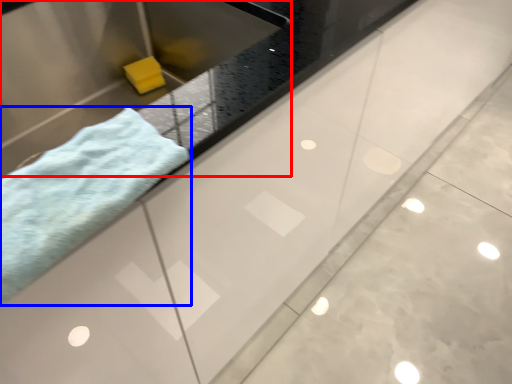
Question: Among these objects, which one is farthest to the camera, sink (highlighted by a red box) or towel (highlighted by a blue box)?

Choices:
 (A) sink
 (B) towel

Answer: (A)